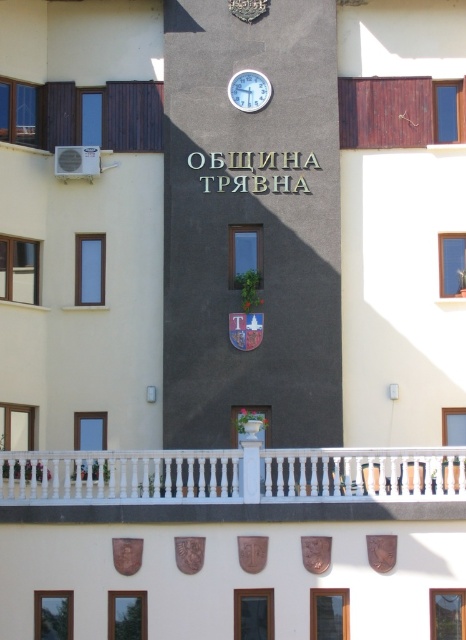
Question: Can you confirm if white wooden railing at center is wider than white plastic clock at upper center?

Choices:
 (A) no
 (B) yes

Answer: (B)

Question: Which object is farther from the camera taking this photo?

Choices:
 (A) white wooden railing at center
 (B) white plastic clock at upper center

Answer: (B)

Question: Does white wooden railing at center have a lesser width compared to white plastic clock at upper center?

Choices:
 (A) yes
 (B) no

Answer: (B)

Question: Considering the relative positions of white wooden railing at center and white plastic clock at upper center in the image provided, where is white wooden railing at center located with respect to white plastic clock at upper center?

Choices:
 (A) below
 (B) above

Answer: (A)

Question: Which object is farther from the camera taking this photo?

Choices:
 (A) white wooden railing at center
 (B) white plastic clock at upper center

Answer: (B)